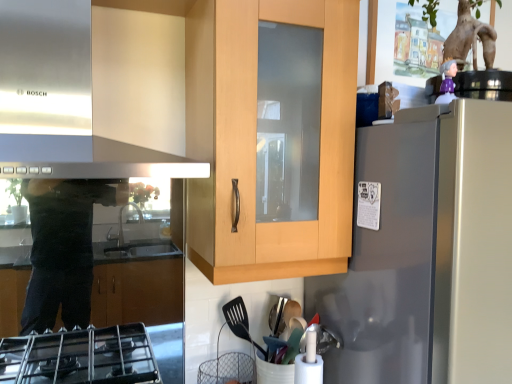
Question: Should I look upward or downward to see satin silver refrigerator at right?

Choices:
 (A) up
 (B) down

Answer: (B)

Question: Is satin silver refrigerator at right at the left side of stainless steel exhaust hood at upper left?

Choices:
 (A) yes
 (B) no

Answer: (B)

Question: From a real-world perspective, is satin silver refrigerator at right physically above stainless steel exhaust hood at upper left?

Choices:
 (A) no
 (B) yes

Answer: (A)

Question: Is satin silver refrigerator at right positioned before stainless steel exhaust hood at upper left?

Choices:
 (A) no
 (B) yes

Answer: (A)

Question: From a real-world perspective, is satin silver refrigerator at right positioned under stainless steel exhaust hood at upper left based on gravity?

Choices:
 (A) no
 (B) yes

Answer: (B)

Question: Is satin silver refrigerator at right not near stainless steel exhaust hood at upper left?

Choices:
 (A) no
 (B) yes

Answer: (A)

Question: Is stainless steel exhaust hood at upper left inside satin silver refrigerator at right?

Choices:
 (A) no
 (B) yes

Answer: (A)

Question: Is stainless steel exhaust hood at upper left behind satin silver refrigerator at right?

Choices:
 (A) yes
 (B) no

Answer: (B)

Question: From the image's perspective, is stainless steel exhaust hood at upper left located above satin silver refrigerator at right?

Choices:
 (A) no
 (B) yes

Answer: (B)

Question: Is stainless steel exhaust hood at upper left at the left side of satin silver refrigerator at right?

Choices:
 (A) no
 (B) yes

Answer: (B)

Question: From the image's perspective, is stainless steel exhaust hood at upper left beneath satin silver refrigerator at right?

Choices:
 (A) no
 (B) yes

Answer: (A)

Question: Is stainless steel exhaust hood at upper left aimed at satin silver refrigerator at right?

Choices:
 (A) no
 (B) yes

Answer: (A)

Question: Would you say satin silver refrigerator at right is part of stainless steel exhaust hood at upper left's contents?

Choices:
 (A) yes
 (B) no

Answer: (B)

Question: In the image, is stainless steel exhaust hood at upper left positioned in front of or behind satin silver refrigerator at right?

Choices:
 (A) behind
 (B) front

Answer: (B)